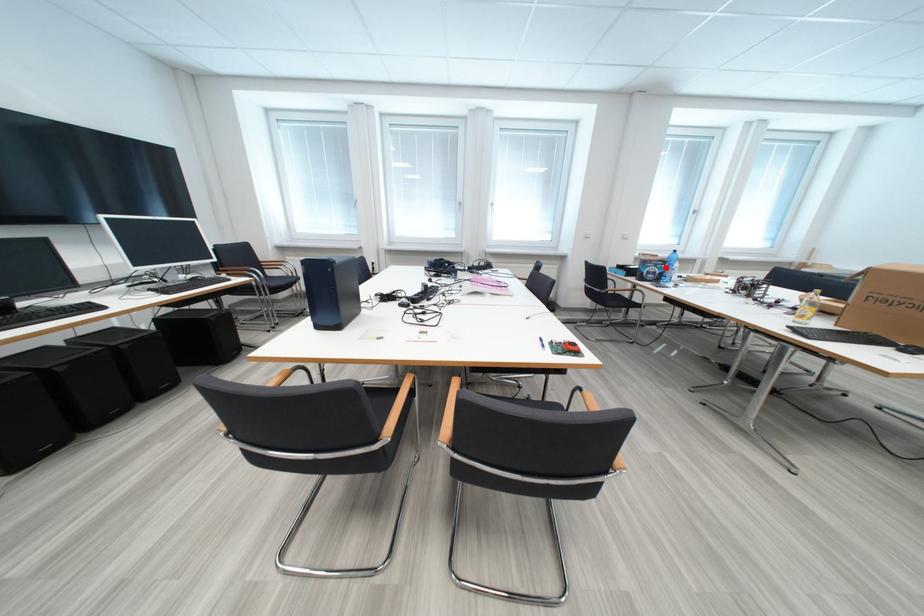
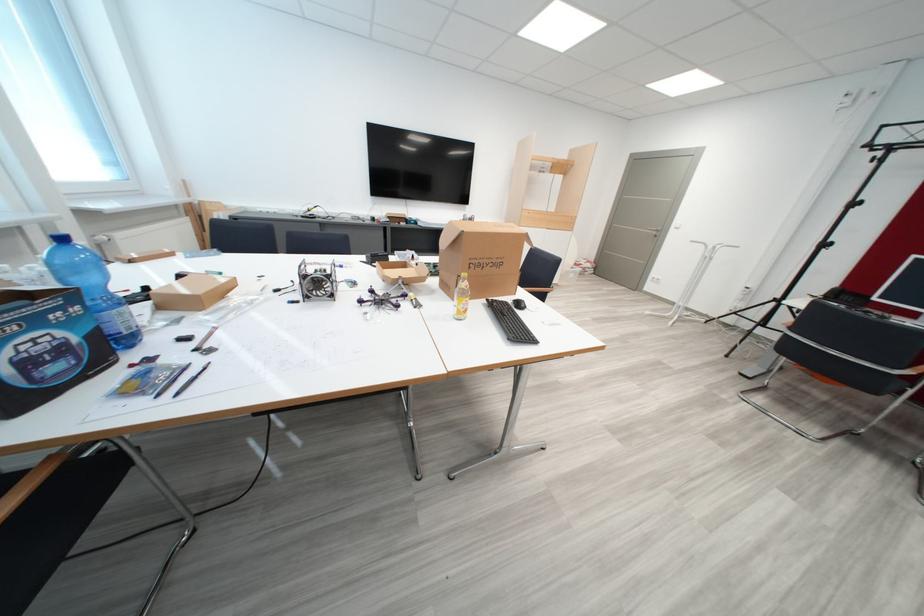
Find the pixel in the second image that matches the highlighted location in the first image.

(46, 323)